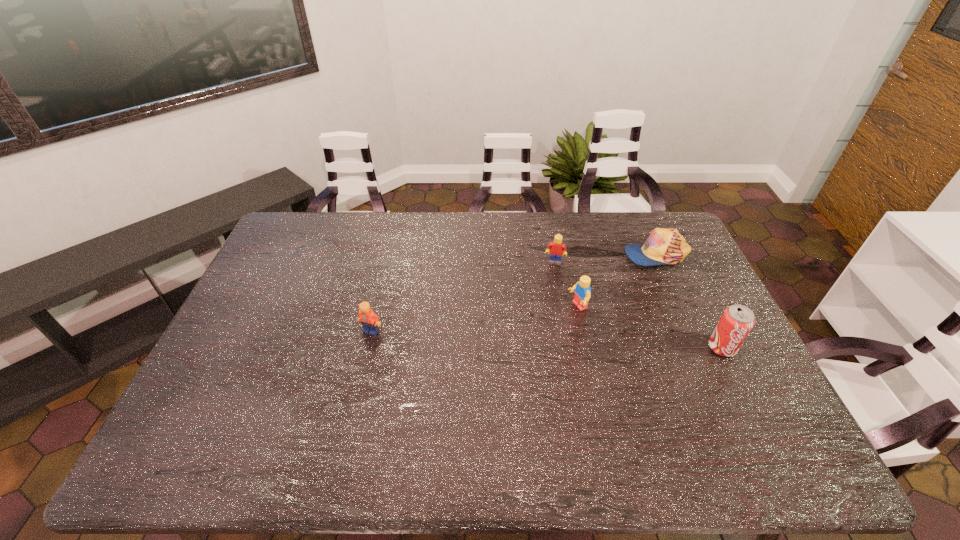
This screenshot has height=540, width=960. I want to click on vacant space located on the front-facing side of the third farthest object, so click(483, 346).

I want to click on free location located on the front-facing side of the third farthest object, so click(522, 330).

At what (x,y) coordinates should I click in order to perform the action: click on vacant position located on the bill of the cap. Please return your answer as a coordinate pair (x, y). The width and height of the screenshot is (960, 540). Looking at the image, I should click on (585, 294).

Where is `free spot located 0.140m on the bill of the cap`? This screenshot has width=960, height=540. free spot located 0.140m on the bill of the cap is located at coordinates (606, 281).

Locate an element on the screen. This screenshot has width=960, height=540. free location located on the bill of the cap is located at coordinates [604, 282].

Find the location of a particular element. The image size is (960, 540). free space located on the front-facing side of the farthest Lego is located at coordinates (552, 275).

Where is `free space located 0.100m on the front-facing side of the farthest Lego`? free space located 0.100m on the front-facing side of the farthest Lego is located at coordinates (550, 285).

At what (x,y) coordinates should I click in order to perform the action: click on vacant space positioned 0.380m on the front-facing side of the farthest Lego. Please return your answer as a coordinate pair (x, y). This screenshot has height=540, width=960. Looking at the image, I should click on (540, 353).

At what (x,y) coordinates should I click in order to perform the action: click on object positioned at the far edge. Please return your answer as a coordinate pair (x, y). This screenshot has height=540, width=960. Looking at the image, I should click on tap(664, 246).

Identify the location of soda can at the right edge. The image size is (960, 540). (736, 322).